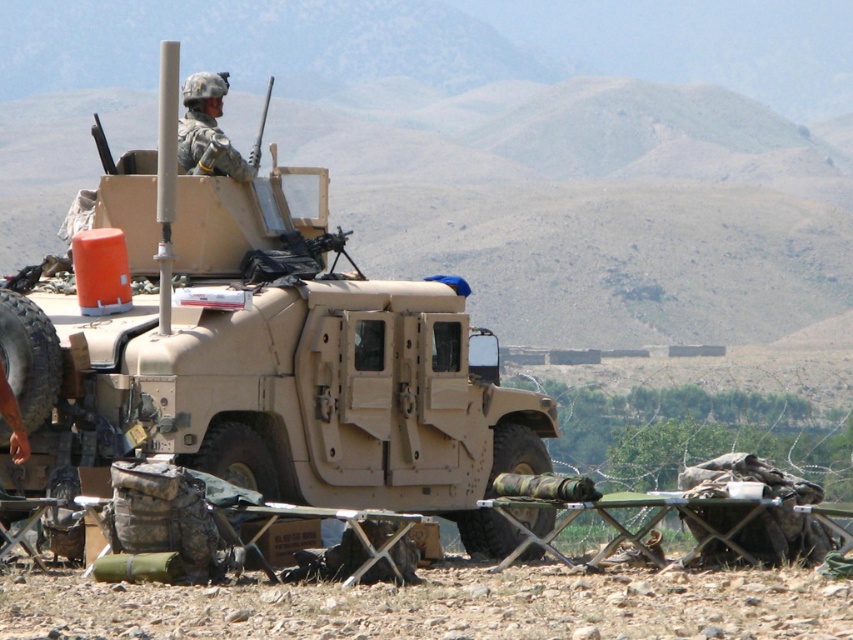
You are a soldier in the field and need to locate the tan matte military vehicle at center. Using the coordinates provided, can you confirm if the point at (262, 353) is the correct location for the vehicle?

Yes, the point at (262, 353) corresponds to the tan matte military vehicle at center as stated in the objects description.

You are a military planner assessing the scene. The tan matte military vehicle at center and the camouflage helmet at upper center are both in view. Which object appears larger in the image?

The camouflage helmet at upper center appears larger in the image because the tan matte military vehicle at center has a smaller size compared to camouflage helmet at upper center.